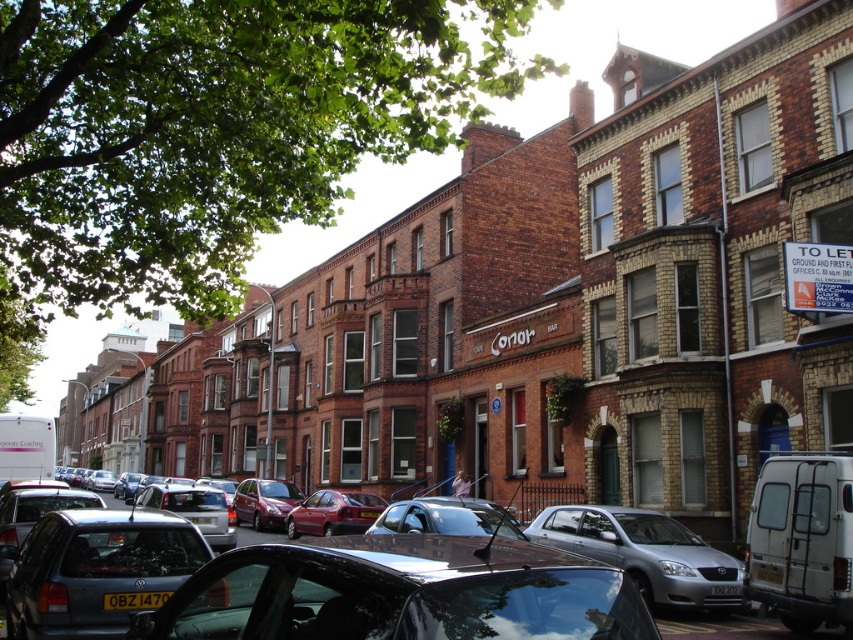
You are a delivery driver who needs to park your vehicle between the silver metallic car at center and the black plastic license plate at lower center. Can your standard delivery van, which is 2 meters wide, fit in the space between them?

The silver metallic car at center is wider than the black plastic license plate at lower center. However, without knowing the exact distance between them, it is impossible to determine if the 2 meter wide delivery van can fit between them.

You are a delivery driver approaching the street and need to read the license plates on the cars. Which license plate, the black plastic license plate at lower center or the yellow plastic license plate at center, is easier to read from your current position?

The black plastic license plate at lower center is closer to the viewer than the yellow plastic license plate at center, so it is easier to read from your current position.